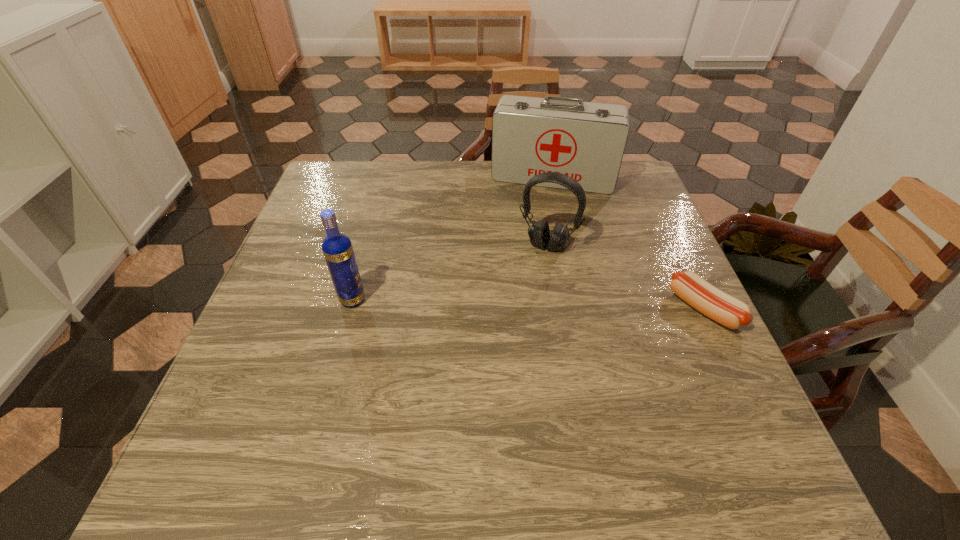
Where is `free spot on the desktop that is between the vodka and the rightmost object and is positioned on the front-facing side of the second farthest object`? free spot on the desktop that is between the vodka and the rightmost object and is positioned on the front-facing side of the second farthest object is located at coordinates (521, 304).

This screenshot has height=540, width=960. What are the coordinates of `vacant space on the desktop that is between the leftmost object and the shortest object and is positioned on the front-facing side of the first-aid kit` in the screenshot? It's located at (530, 304).